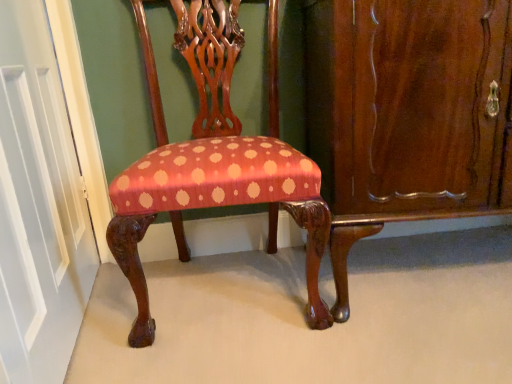
Locate an element on the screen. The height and width of the screenshot is (384, 512). silky red fabric chair at center is located at coordinates (214, 158).

Image resolution: width=512 pixels, height=384 pixels. In order to click on silky red fabric chair at center in this screenshot , I will do `click(214, 158)`.

Is white painted wood door at left facing towards silky red fabric chair at center?

Yes, white painted wood door at left is aimed at silky red fabric chair at center.

Considering the sizes of objects white painted wood door at left and silky red fabric chair at center in the image provided, who is bigger, white painted wood door at left or silky red fabric chair at center?

Bigger between the two is silky red fabric chair at center.

Is point (16, 330) positioned before point (152, 340)?

That is True.

Based on the photo, how many degrees apart are the facing directions of white painted wood door at left and silky red fabric chair at center?

The facing directions of white painted wood door at left and silky red fabric chair at center are 81.9 degrees apart.

From a real-world perspective, is mahogany wood dresser at right positioned under silky red fabric chair at center based on gravity?

Yes, from a real-world perspective, mahogany wood dresser at right is below silky red fabric chair at center.

Based on the photo, is mahogany wood dresser at right looking in the opposite direction of silky red fabric chair at center?

No, mahogany wood dresser at right's orientation is not away from silky red fabric chair at center.

Which is farther from the camera, [490,170] or [143,195]?

The point [490,170] is behind.

Does silky red fabric chair at center have a greater height compared to mahogany wood dresser at right?

Yes.

From the image's perspective, which is above, silky red fabric chair at center or mahogany wood dresser at right?

mahogany wood dresser at right, from the image's perspective.

Measure the distance from silky red fabric chair at center to mahogany wood dresser at right.

The distance of silky red fabric chair at center from mahogany wood dresser at right is 11.58 inches.

Locate an element on the screen. chair in front of the mahogany wood dresser at right is located at coordinates (214, 158).

What's the angular difference between white painted wood door at left and mahogany wood dresser at right's facing directions?

There is a 81.9-degree angle between the facing directions of white painted wood door at left and mahogany wood dresser at right.

Is white painted wood door at left positioned with its back to mahogany wood dresser at right?

That's right, white painted wood door at left is facing away from mahogany wood dresser at right.

Does point (66, 222) appear closer or farther from the camera than point (318, 96)?

Point (66, 222) appears to be farther away from the viewer than point (318, 96).

Who is taller, white painted wood door at left or mahogany wood dresser at right?

Standing taller between the two is white painted wood door at left.

From the image's perspective, is silky red fabric chair at center above white painted wood door at left?

Yes.

Considering the sizes of objects silky red fabric chair at center and white painted wood door at left in the image provided, who is thinner, silky red fabric chair at center or white painted wood door at left?

With smaller width is white painted wood door at left.

Image resolution: width=512 pixels, height=384 pixels. I want to click on chair to the right of white painted wood door at left, so click(214, 158).

Does mahogany wood dresser at right have a lesser width compared to white painted wood door at left?

No, mahogany wood dresser at right is not thinner than white painted wood door at left.

How much distance is there between mahogany wood dresser at right and white painted wood door at left?

mahogany wood dresser at right is 33.37 inches from white painted wood door at left.

Can white painted wood door at left be found inside mahogany wood dresser at right?

No, white painted wood door at left is not a part of mahogany wood dresser at right.

From a real-world perspective, is mahogany wood dresser at right beneath white painted wood door at left?

Indeed, from a real-world perspective, mahogany wood dresser at right is positioned beneath white painted wood door at left.

In the image, there is a white painted wood door at left. Where is `chair below it (from a real-world perspective)`? chair below it (from a real-world perspective) is located at coordinates (214, 158).

Identify the location of chair in front of the mahogany wood dresser at right. The image size is (512, 384). (214, 158).

From the image, which object appears to be farther from white painted wood door at left, mahogany wood dresser at right or silky red fabric chair at center?

Based on the image, mahogany wood dresser at right appears to be further to white painted wood door at left.

Based on the photo, which object lies nearer to the anchor point mahogany wood dresser at right, white painted wood door at left or silky red fabric chair at center?

silky red fabric chair at center lies closer to mahogany wood dresser at right than the other object.

Looking at the image, which one is located closer to white painted wood door at left, silky red fabric chair at center or mahogany wood dresser at right?

Based on the image, silky red fabric chair at center appears to be nearer to white painted wood door at left.

Considering their positions, is white painted wood door at left positioned further to silky red fabric chair at center than mahogany wood dresser at right?

Based on the image, white painted wood door at left appears to be further to silky red fabric chair at center.

Which object lies further to the anchor point silky red fabric chair at center, mahogany wood dresser at right or white painted wood door at left?

white painted wood door at left is further to silky red fabric chair at center.

When comparing their distances from mahogany wood dresser at right, does silky red fabric chair at center or white painted wood door at left seem closer?

silky red fabric chair at center is positioned closer to the anchor mahogany wood dresser at right.

Where is `chair situated between white painted wood door at left and mahogany wood dresser at right from left to right`? The width and height of the screenshot is (512, 384). chair situated between white painted wood door at left and mahogany wood dresser at right from left to right is located at coordinates (214, 158).